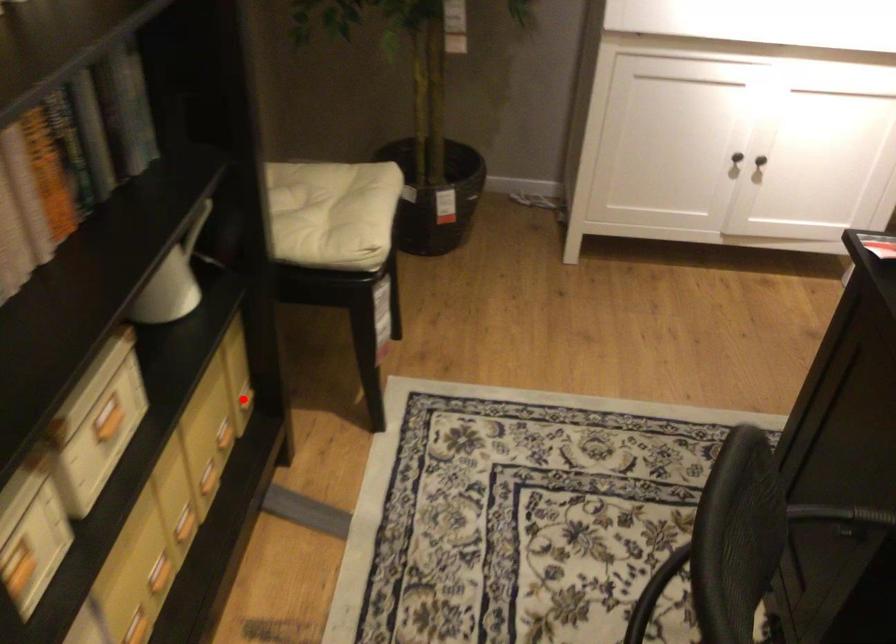
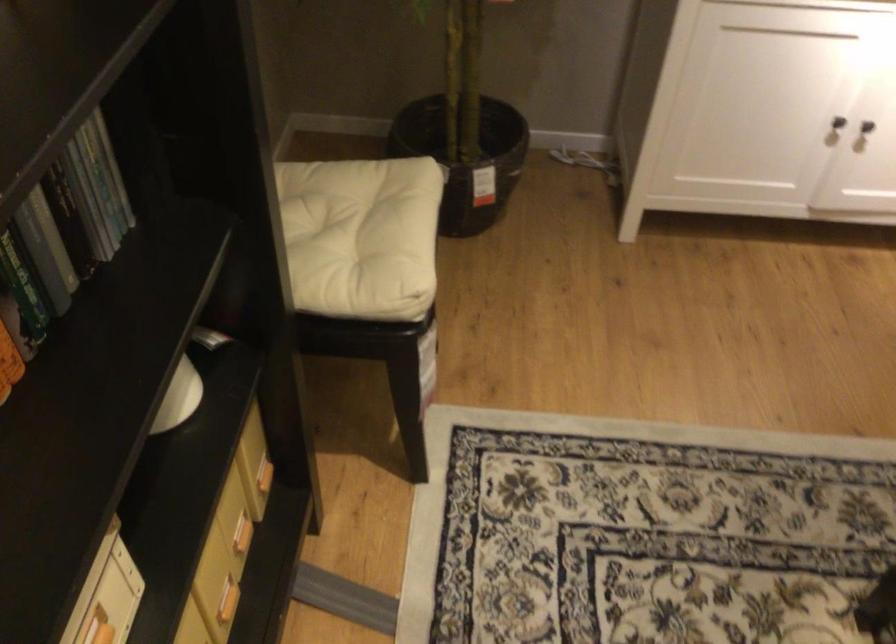
In the second image, find the point that corresponds to the highlighted location in the first image.

(263, 476)